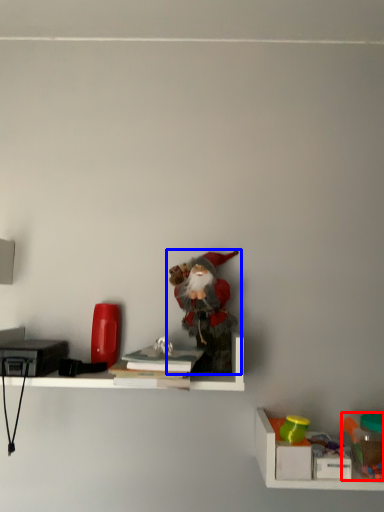
Question: Which of the following is the closest to the observer, toy (highlighted by a red box) or toy (highlighted by a blue box)?

Choices:
 (A) toy
 (B) toy

Answer: (A)